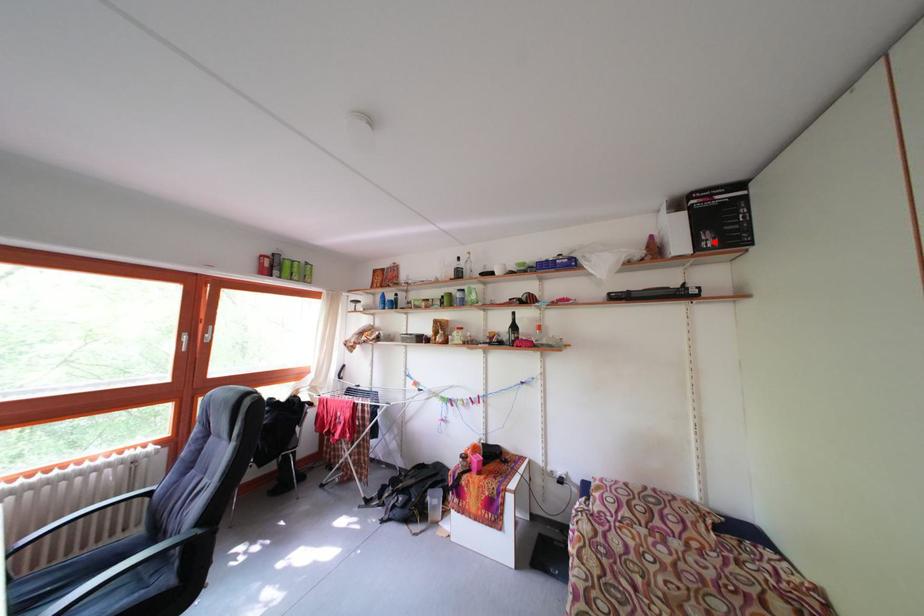
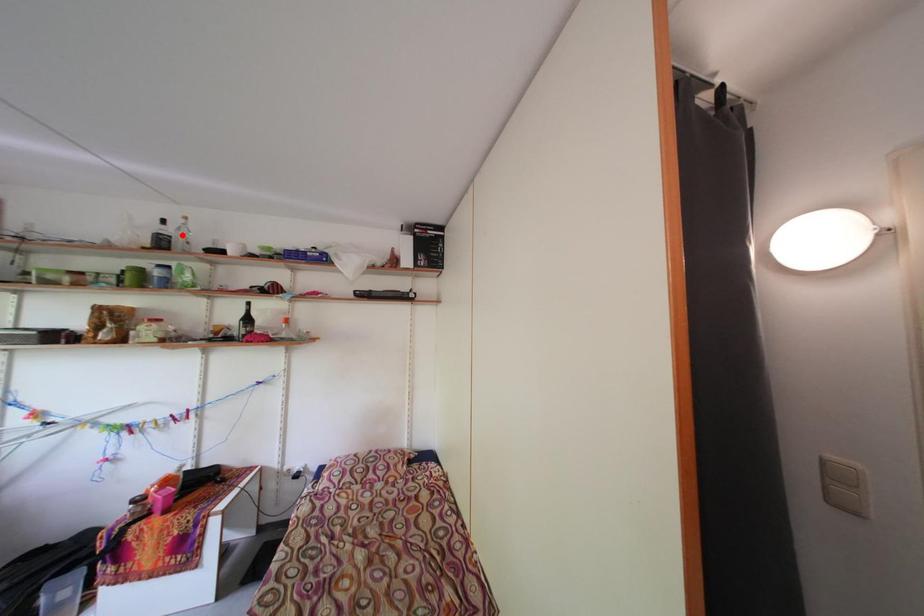
I am providing you with two images of the same scene from different viewpoints. A red point is marked on the first image and another point is marked on the second image. Are the points marked in image1 and image2 representing the same 3D position?

No